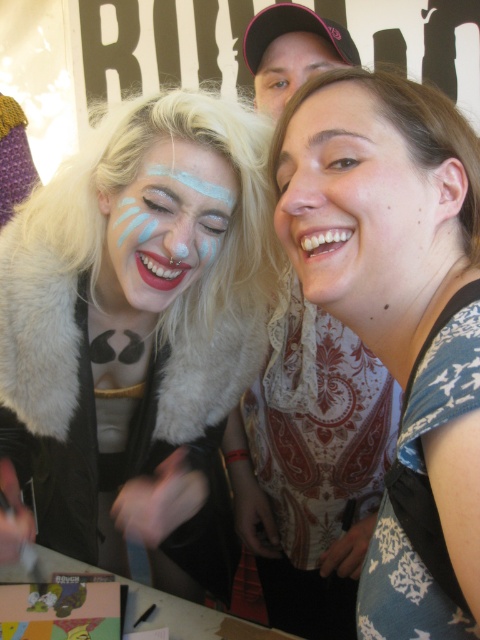
Where is `fur coat at center`? fur coat at center is located at coordinates (140, 332).

Which is in front, point (126, 296) or point (287, 65)?

Point (126, 296)

Does point (148, 474) lie in front of point (263, 80)?

Yes, point (148, 474) is closer to viewer.

Image resolution: width=480 pixels, height=640 pixels. I want to click on fur coat at center, so click(140, 332).

Does fur coat at center have a greater width compared to white lace dress at center?

Indeed, fur coat at center has a greater width compared to white lace dress at center.

Measure the distance between point (189, 316) and camera.

They are 37.64 inches apart.

Locate an element on the screen. This screenshot has height=640, width=480. fur coat at center is located at coordinates [140, 332].

Locate an element on the screen. fur coat at center is located at coordinates (140, 332).

At what (x,y) coordinates should I click in order to perform the action: click on fur coat at center. Please return your answer as a coordinate pair (x, y). Looking at the image, I should click on (140, 332).